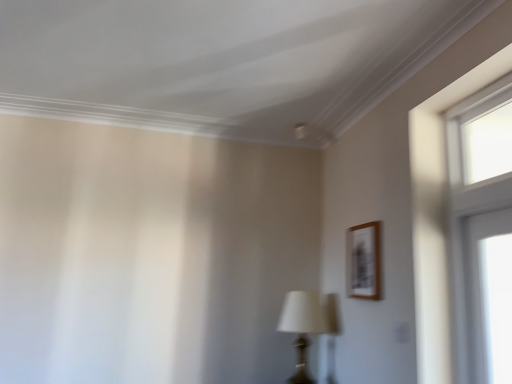
Question: Does clear glass window at upper right lie behind wooden frame at upper right?

Choices:
 (A) yes
 (B) no

Answer: (B)

Question: Is clear glass window at upper right wider than wooden frame at upper right?

Choices:
 (A) yes
 (B) no

Answer: (A)

Question: Does clear glass window at upper right have a smaller size compared to wooden frame at upper right?

Choices:
 (A) no
 (B) yes

Answer: (A)

Question: Considering the relative sizes of clear glass window at upper right and wooden frame at upper right in the image provided, is clear glass window at upper right taller than wooden frame at upper right?

Choices:
 (A) yes
 (B) no

Answer: (A)

Question: Is clear glass window at upper right shorter than wooden frame at upper right?

Choices:
 (A) no
 (B) yes

Answer: (A)

Question: Is matte black table lamp at center wider or thinner than wooden frame at upper right?

Choices:
 (A) wide
 (B) thin

Answer: (A)

Question: In the image, is matte black table lamp at center on the left side or the right side of wooden frame at upper right?

Choices:
 (A) right
 (B) left

Answer: (B)

Question: Is matte black table lamp at center taller or shorter than wooden frame at upper right?

Choices:
 (A) short
 (B) tall

Answer: (B)

Question: In the image, is matte black table lamp at center positioned in front of or behind wooden frame at upper right?

Choices:
 (A) front
 (B) behind

Answer: (B)

Question: Would you say clear glass window at upper right is to the left or to the right of matte black table lamp at center in the picture?

Choices:
 (A) left
 (B) right

Answer: (B)

Question: Is clear glass window at upper right taller or shorter than matte black table lamp at center?

Choices:
 (A) tall
 (B) short

Answer: (A)

Question: Is point (501, 114) positioned closer to the camera than point (287, 317)?

Choices:
 (A) closer
 (B) farther

Answer: (A)

Question: In terms of size, does clear glass window at upper right appear bigger or smaller than matte black table lamp at center?

Choices:
 (A) big
 (B) small

Answer: (B)

Question: Looking at the image, does clear glass window at upper right seem bigger or smaller compared to wooden frame at upper right?

Choices:
 (A) small
 (B) big

Answer: (B)

Question: From a real-world perspective, is clear glass window at upper right physically located above or below wooden frame at upper right?

Choices:
 (A) below
 (B) above

Answer: (B)